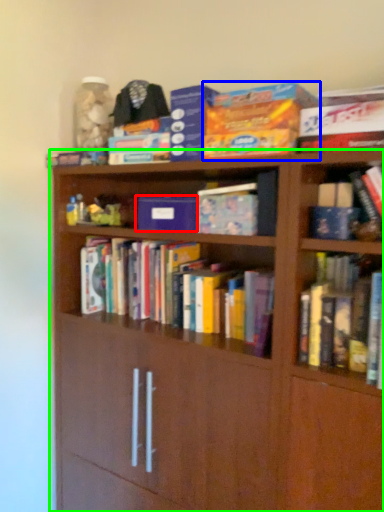
Question: Based on their relative distances, which object is nearer to paperback book (highlighted by a red box)? Choose from paperback book (highlighted by a blue box) and bookcase (highlighted by a green box).

Choices:
 (A) paperback book
 (B) bookcase

Answer: (A)